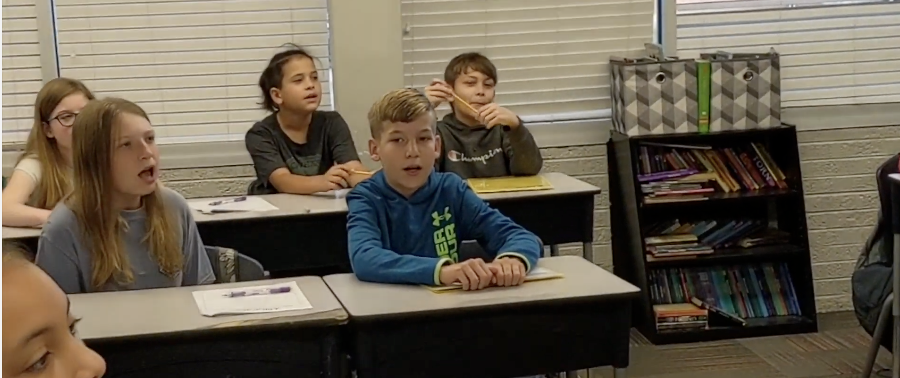
Where is `yellow paper holder`? yellow paper holder is located at coordinates (518, 184), (546, 273).